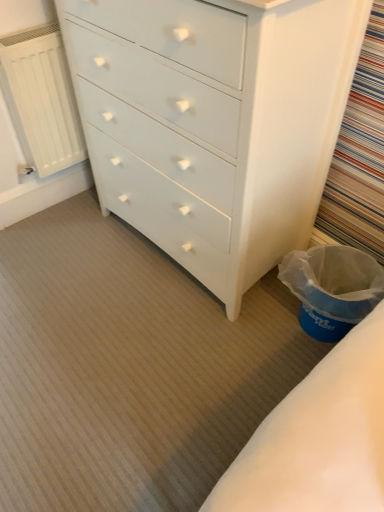
At what (x,y) coordinates should I click in order to perform the action: click on white painted wood chest of drawers at center. Please return your answer as a coordinate pair (x, y). The image size is (384, 512). Looking at the image, I should click on pyautogui.click(x=213, y=123).

This screenshot has height=512, width=384. In order to click on blue plastic laundry basket at lower right in this screenshot , I will do `click(332, 288)`.

Between white matte radiator at left and blue plastic laundry basket at lower right, which one has larger size?

blue plastic laundry basket at lower right.

Which is more to the left, white matte radiator at left or blue plastic laundry basket at lower right?

white matte radiator at left.

I want to click on radiator behind the blue plastic laundry basket at lower right, so click(41, 99).

Is white matte radiator at left next to blue plastic laundry basket at lower right and touching it?

white matte radiator at left and blue plastic laundry basket at lower right are clearly separated.

From their relative heights in the image, would you say white matte radiator at left is taller or shorter than white painted wood chest of drawers at center?

Clearly, white matte radiator at left is shorter compared to white painted wood chest of drawers at center.

This screenshot has height=512, width=384. In order to click on chest of drawers on the right side of white matte radiator at left in this screenshot , I will do `click(213, 123)`.

Is white matte radiator at left oriented towards white painted wood chest of drawers at center?

Yes, white matte radiator at left is aimed at white painted wood chest of drawers at center.

How many degrees apart are the facing directions of white matte radiator at left and white painted wood chest of drawers at center?

The angular difference between white matte radiator at left and white painted wood chest of drawers at center is 86.9 degrees.

Considering the sizes of objects blue plastic laundry basket at lower right and white matte radiator at left in the image provided, who is bigger, blue plastic laundry basket at lower right or white matte radiator at left?

With larger size is blue plastic laundry basket at lower right.

Does blue plastic laundry basket at lower right contain white matte radiator at left?

Definitely not — white matte radiator at left is not inside blue plastic laundry basket at lower right.

From the picture: Is blue plastic laundry basket at lower right facing towards white matte radiator at left?

No.

Considering the relative sizes of white painted wood chest of drawers at center and white matte radiator at left in the image provided, is white painted wood chest of drawers at center wider than white matte radiator at left?

Correct, the width of white painted wood chest of drawers at center exceeds that of white matte radiator at left.

Locate an element on the screen. Image resolution: width=384 pixels, height=512 pixels. chest of drawers on the right of the white matte radiator at left is located at coordinates (213, 123).

Image resolution: width=384 pixels, height=512 pixels. In order to click on chest of drawers lying on the left of blue plastic laundry basket at lower right in this screenshot , I will do `click(213, 123)`.

Is blue plastic laundry basket at lower right at the left side of white painted wood chest of drawers at center?

In fact, blue plastic laundry basket at lower right is to the right of white painted wood chest of drawers at center.

How different are the orientations of blue plastic laundry basket at lower right and white painted wood chest of drawers at center in degrees?

The facing directions of blue plastic laundry basket at lower right and white painted wood chest of drawers at center are 5.75 degrees apart.

Relative to blue plastic laundry basket at lower right, is white painted wood chest of drawers at center in front or behind?

Clearly, white painted wood chest of drawers at center is in front of blue plastic laundry basket at lower right.

Between white painted wood chest of drawers at center and blue plastic laundry basket at lower right, which one has less height?

With less height is blue plastic laundry basket at lower right.

Does white painted wood chest of drawers at center have a lesser width compared to blue plastic laundry basket at lower right?

No, white painted wood chest of drawers at center is not thinner than blue plastic laundry basket at lower right.

In the scene shown: Can you confirm if white painted wood chest of drawers at center is positioned to the left of blue plastic laundry basket at lower right?

Yes, white painted wood chest of drawers at center is to the left of blue plastic laundry basket at lower right.

Image resolution: width=384 pixels, height=512 pixels. Identify the location of radiator above the blue plastic laundry basket at lower right (from a real-world perspective). (41, 99).

Find the location of a particular element. The height and width of the screenshot is (512, 384). chest of drawers below the white matte radiator at left (from the image's perspective) is located at coordinates (213, 123).

Looking at the image, which one is located further to white matte radiator at left, white painted wood chest of drawers at center or blue plastic laundry basket at lower right?

blue plastic laundry basket at lower right is further to white matte radiator at left.

From the image, which object appears to be farther from white painted wood chest of drawers at center, white matte radiator at left or blue plastic laundry basket at lower right?

Among the two, white matte radiator at left is located further to white painted wood chest of drawers at center.

Considering their positions, is blue plastic laundry basket at lower right positioned further to white matte radiator at left than white painted wood chest of drawers at center?

blue plastic laundry basket at lower right.

From the picture: From the image, which object appears to be farther from white painted wood chest of drawers at center, blue plastic laundry basket at lower right or white matte radiator at left?

→ white matte radiator at left is positioned further to the anchor white painted wood chest of drawers at center.

Which object lies further to the anchor point blue plastic laundry basket at lower right, white painted wood chest of drawers at center or white matte radiator at left?

white matte radiator at left.

When comparing their distances from blue plastic laundry basket at lower right, does white matte radiator at left or white painted wood chest of drawers at center seem further?

white matte radiator at left.

The height and width of the screenshot is (512, 384). I want to click on chest of drawers between white matte radiator at left and blue plastic laundry basket at lower right from left to right, so click(x=213, y=123).